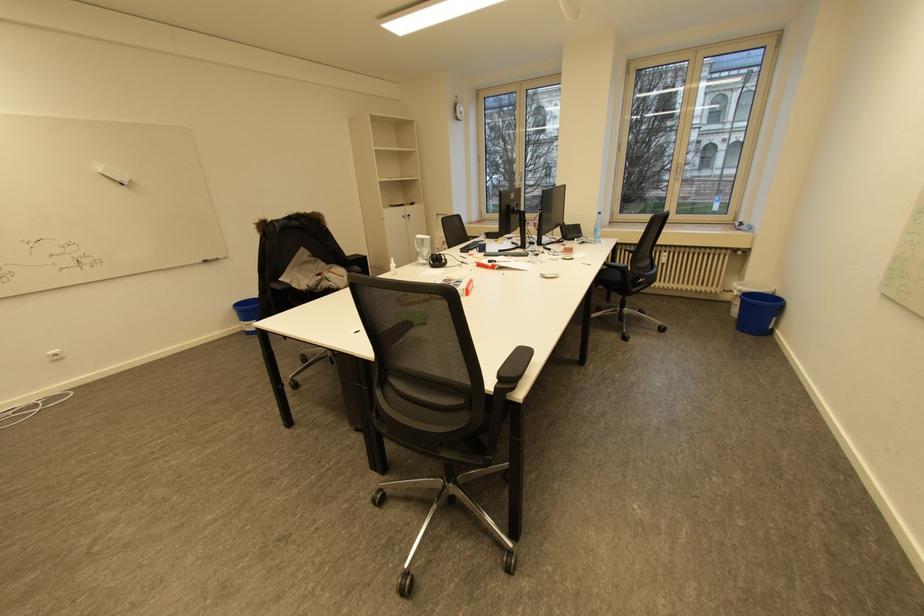
Locate an element on the screen. The image size is (924, 616). plastic water bottle is located at coordinates (598, 228).